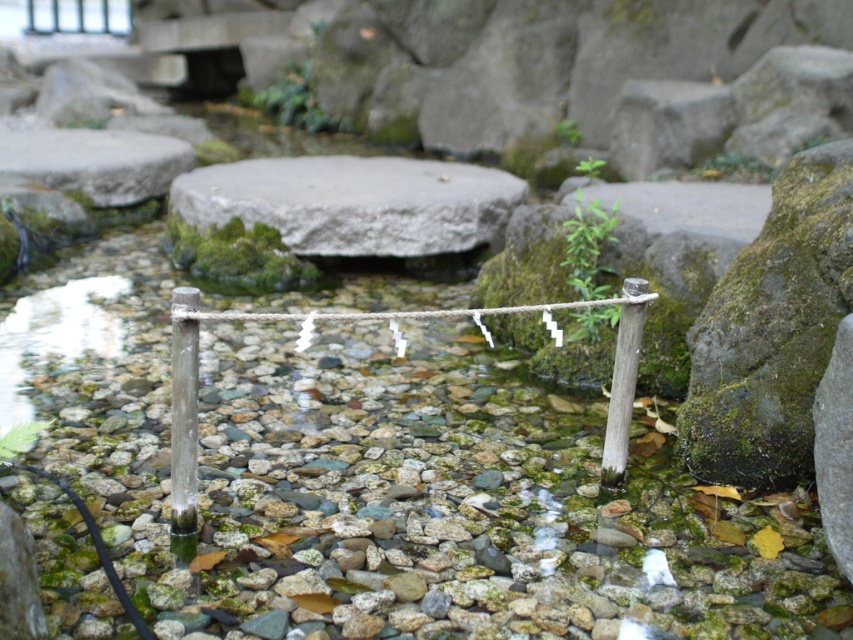
Based on the photo, you are standing in the serene natural setting and want to walk towards the gray stone boulder at center and the white wood pole at center. Which object will you reach first?

You will reach the gray stone boulder at center first because it is closer to you than the white wood pole at center.

You are a photographer holding a camera that is 1.8 meters tall. You want to take a photo of the white wood pole at center from your current position. Is the pole within your reach to adjust its position?

The white wood pole at center is 1.91 meters away from the camera. Since the photographer is holding the camera at 1.8 meters height, the distance to the pole is slightly beyond the photographer reach, so the pole might not be easily adjustable from the current position.

You are a hiker carrying a 1.5 meter wide backpack. You come across the gray stone boulder at center and the white wood pole at center. Which object can you pass through without removing your backpack?

The gray stone boulder at center is wider than the white wood pole at center. Therefore, you can pass through the gray stone boulder at center without removing your backpack since it has a wider passage.